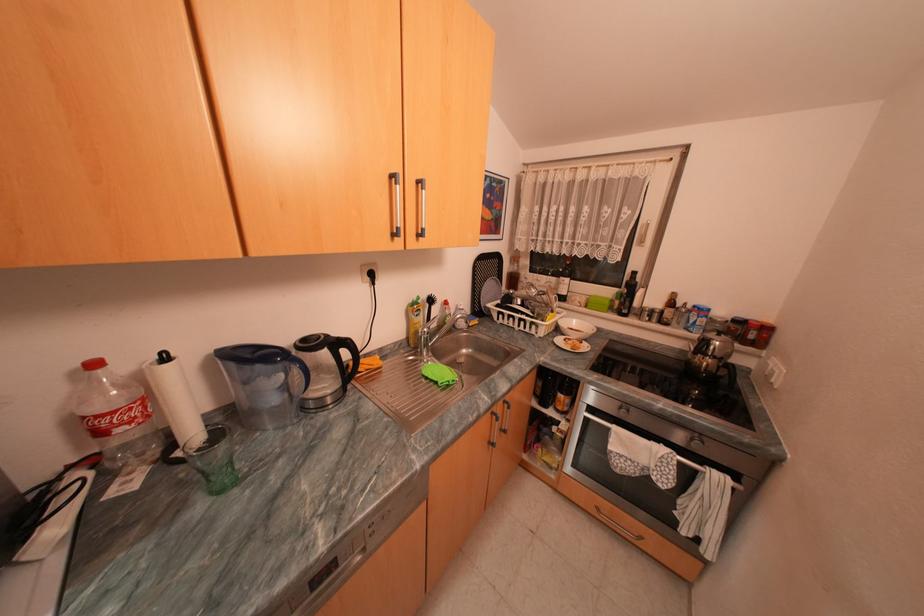
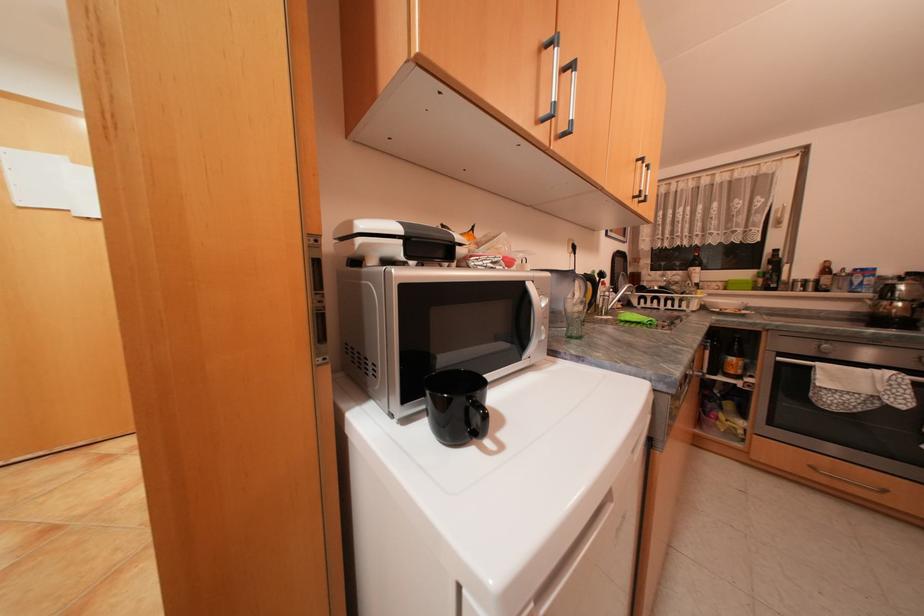
In a continuous first-person perspective shot, in which direction is the camera moving?

The movement direction of the cameraman is left, backward.